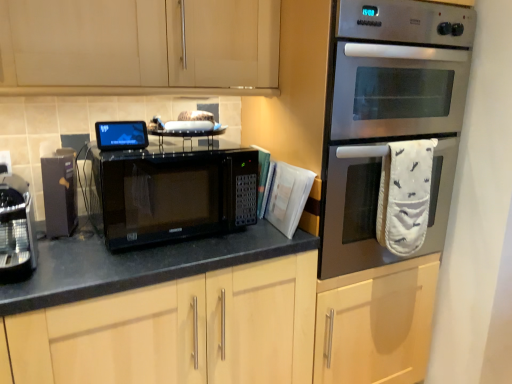
Question: In terms of width, does matte black coffee machine at left, the 2th appliance positioned from the right, look wider or thinner when compared to black matte microwave at center?

Choices:
 (A) thin
 (B) wide

Answer: (A)

Question: In terms of height, does matte black coffee machine at left, the second appliance viewed from the left, look taller or shorter compared to black matte microwave at center?

Choices:
 (A) tall
 (B) short

Answer: (A)

Question: Which object is positioned farthest from the matte black microwave at center?

Choices:
 (A) stainless steel oven at right
 (B) matte black microwave at center, acting as the 3th appliance starting from the left
 (C) matte black coffee machine at left, the 2th appliance positioned from the right
 (D) sleek metallic coffee machine at left, acting as the 1th appliance starting from the left
 (E) black matte microwave at center

Answer: (B)

Question: Which is nearer to the matte black microwave at center, acting as the 3th appliance starting from the left?

Choices:
 (A) black matte microwave at center
 (B) sleek metallic coffee machine at left, acting as the 1th appliance starting from the left
 (C) matte black microwave at center
 (D) stainless steel oven at right
 (E) matte black coffee machine at left, the 2th appliance positioned from the right

Answer: (A)